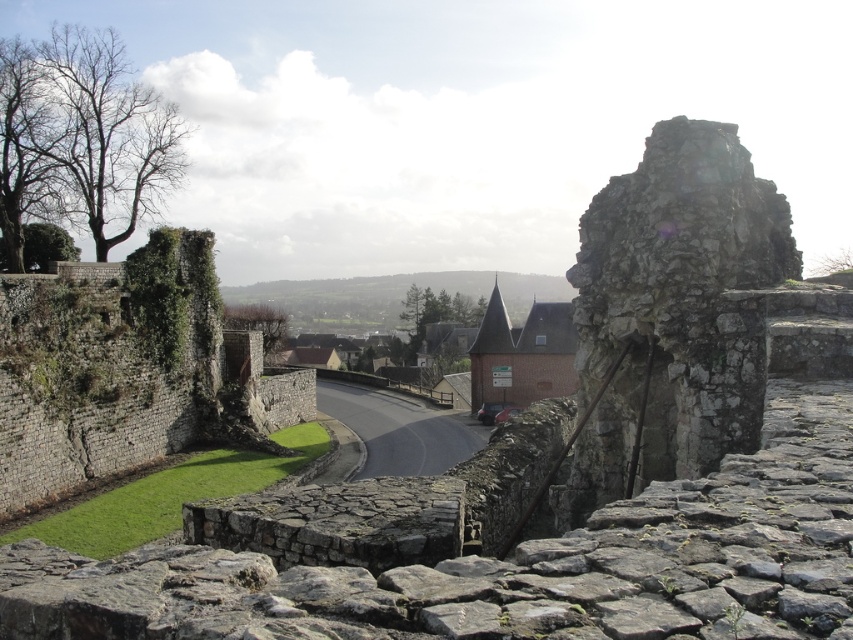
Question: In this image, where is green mossy stone wall at left located relative to brick tower at center?

Choices:
 (A) left
 (B) right

Answer: (A)

Question: Is green mossy stone wall at left wider than brick tower at center?

Choices:
 (A) no
 (B) yes

Answer: (A)

Question: Does green mossy stone wall at left have a greater width compared to brick tower at center?

Choices:
 (A) yes
 (B) no

Answer: (B)

Question: Which point is closer to the camera?

Choices:
 (A) green mossy stone wall at left
 (B) brick tower at center

Answer: (B)